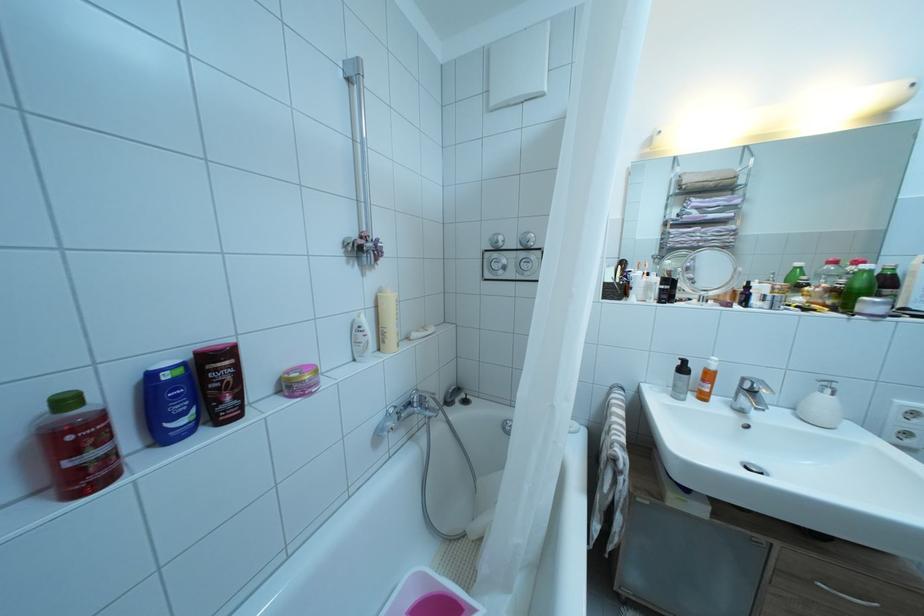
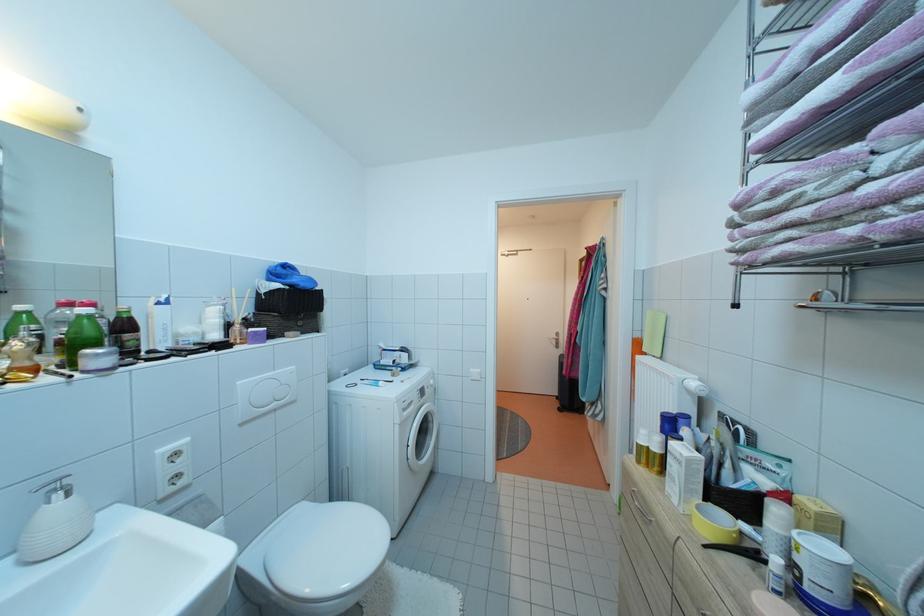
Find the pixel in the second image that matches pixel 804 274 in the first image.

(28, 318)